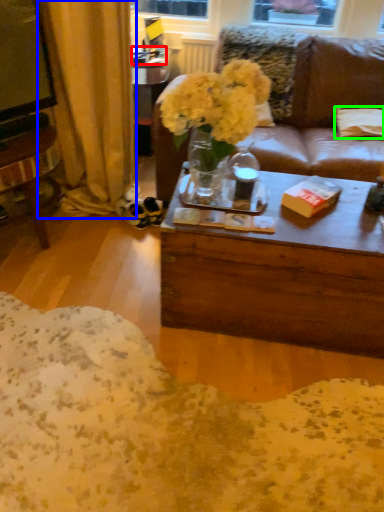
Question: Based on their relative distances, which object is farther from box (highlighted by a red box)? Choose from curtain (highlighted by a blue box) and pillow (highlighted by a green box).

Choices:
 (A) curtain
 (B) pillow

Answer: (B)